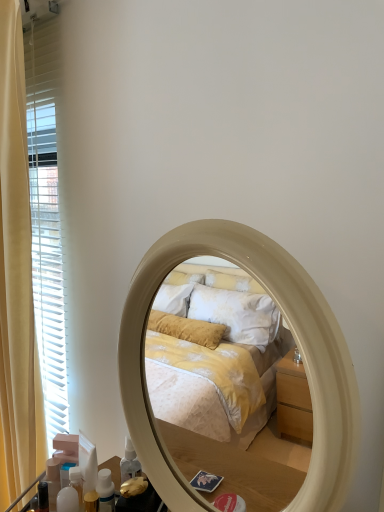
Question: Is the depth of beige glossy mirror at center greater than that of translucent plastic bottles at lower left, acting as the first toiletry starting from the front?

Choices:
 (A) yes
 (B) no

Answer: (B)

Question: Considering the relative sizes of beige glossy mirror at center and translucent plastic bottles at lower left, acting as the first toiletry starting from the front, in the image provided, is beige glossy mirror at center thinner than translucent plastic bottles at lower left, acting as the first toiletry starting from the front,?

Choices:
 (A) yes
 (B) no

Answer: (B)

Question: Is beige glossy mirror at center located outside translucent plastic bottles at lower left, acting as the 2th toiletry starting from the back?

Choices:
 (A) no
 (B) yes

Answer: (B)

Question: Is beige glossy mirror at center next to translucent plastic bottles at lower left, acting as the first toiletry starting from the front?

Choices:
 (A) no
 (B) yes

Answer: (A)

Question: Is beige glossy mirror at center turned away from translucent plastic bottles at lower left, acting as the first toiletry starting from the front?

Choices:
 (A) yes
 (B) no

Answer: (B)

Question: In the image, is translucent plastic bottle at lower left, the first toiletry viewed from the left, positioned in front of or behind beige glossy mirror at center?

Choices:
 (A) behind
 (B) front

Answer: (A)

Question: Looking at their shapes, would you say translucent plastic bottle at lower left, arranged as the 2th toiletry when viewed from the front, is wider or thinner than beige glossy mirror at center?

Choices:
 (A) wide
 (B) thin

Answer: (B)

Question: Is point [46, 479] closer or farther from the camera than point [203, 506]?

Choices:
 (A) farther
 (B) closer

Answer: (A)

Question: From a real-world perspective, is translucent plastic bottle at lower left, the first toiletry viewed from the left, above or below beige glossy mirror at center?

Choices:
 (A) below
 (B) above

Answer: (A)

Question: Considering the relative positions of translucent plastic bottles at lower left, the 2th toiletry viewed from the left, and yellow fabric curtain at left in the image provided, is translucent plastic bottles at lower left, the 2th toiletry viewed from the left, to the left or to the right of yellow fabric curtain at left?

Choices:
 (A) right
 (B) left

Answer: (A)

Question: From the image's perspective, relative to yellow fabric curtain at left, is translucent plastic bottles at lower left, the 1th toiletry from the right, above or below?

Choices:
 (A) above
 (B) below

Answer: (B)

Question: Considering the positions of translucent plastic bottles at lower left, acting as the 2th toiletry starting from the back, and yellow fabric curtain at left in the image, is translucent plastic bottles at lower left, acting as the 2th toiletry starting from the back, bigger or smaller than yellow fabric curtain at left?

Choices:
 (A) big
 (B) small

Answer: (B)

Question: Is translucent plastic bottles at lower left, acting as the first toiletry starting from the front, situated inside yellow fabric curtain at left or outside?

Choices:
 (A) outside
 (B) inside

Answer: (A)

Question: In terms of width, does yellow fabric curtain at left look wider or thinner when compared to translucent plastic bottle at lower left, arranged as the 2th toiletry when viewed from the front?

Choices:
 (A) thin
 (B) wide

Answer: (B)

Question: Visually, is yellow fabric curtain at left positioned to the left or to the right of translucent plastic bottle at lower left, placed as the second toiletry when sorted from right to left?

Choices:
 (A) left
 (B) right

Answer: (A)